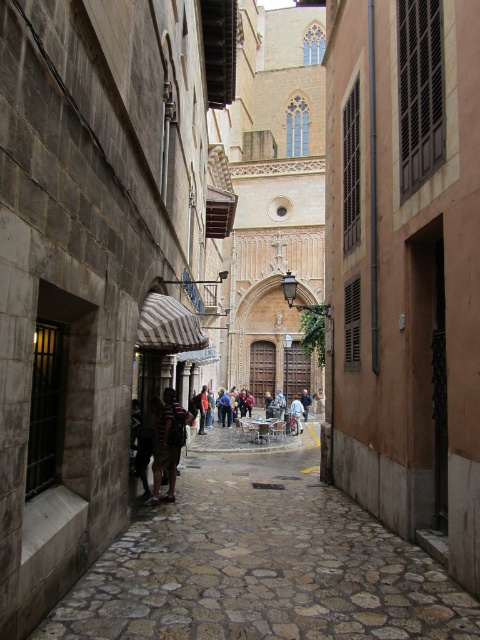
Is point (156, 465) farther from camera compared to point (295, 419)?

No, (156, 465) is closer to viewer.

Is striped fabric shirt at center wider than light brown leather jacket at center?

Incorrect, striped fabric shirt at center's width does not surpass light brown leather jacket at center's.

Where is `striped fabric shirt at center`? striped fabric shirt at center is located at coordinates (168, 444).

This screenshot has width=480, height=640. Identify the location of striped fabric shirt at center. (168, 444).

Consider the image. Is stone cobblestone path at center smaller than light brown leather jacket at center?

No.

Is stone cobblestone path at center wider than light brown leather jacket at center?

Indeed, stone cobblestone path at center has a greater width compared to light brown leather jacket at center.

Is point (400, 620) behind point (298, 422)?

No, it is in front of (298, 422).

Locate an element on the screen. The image size is (480, 640). stone cobblestone path at center is located at coordinates (261, 563).

Is point (137, 557) behind point (179, 442)?

No, (137, 557) is closer to viewer.

In order to click on stone cobblestone path at center in this screenshot , I will do `click(261, 563)`.